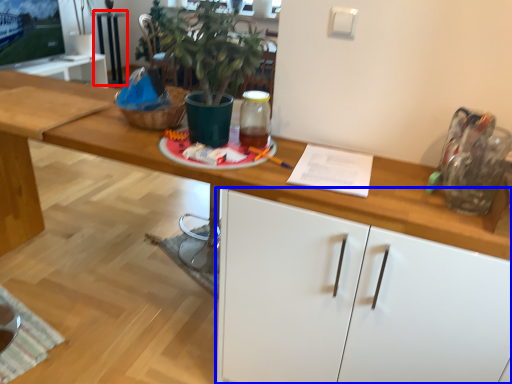
Question: Which object is closer to the camera taking this photo, table (highlighted by a red box) or cabinetry (highlighted by a blue box)?

Choices:
 (A) table
 (B) cabinetry

Answer: (B)